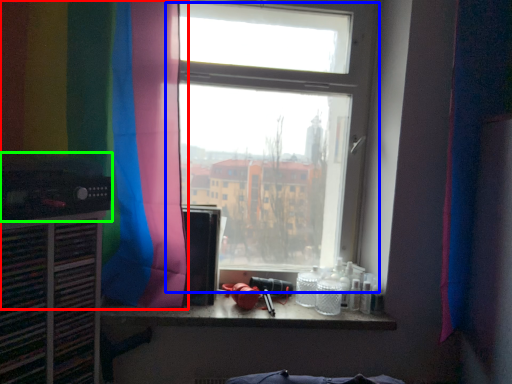
Question: Based on their relative distances, which object is farther from curtain (highlighted by a red box)? Choose from window (highlighted by a blue box) and appliance (highlighted by a green box).

Choices:
 (A) window
 (B) appliance

Answer: (A)